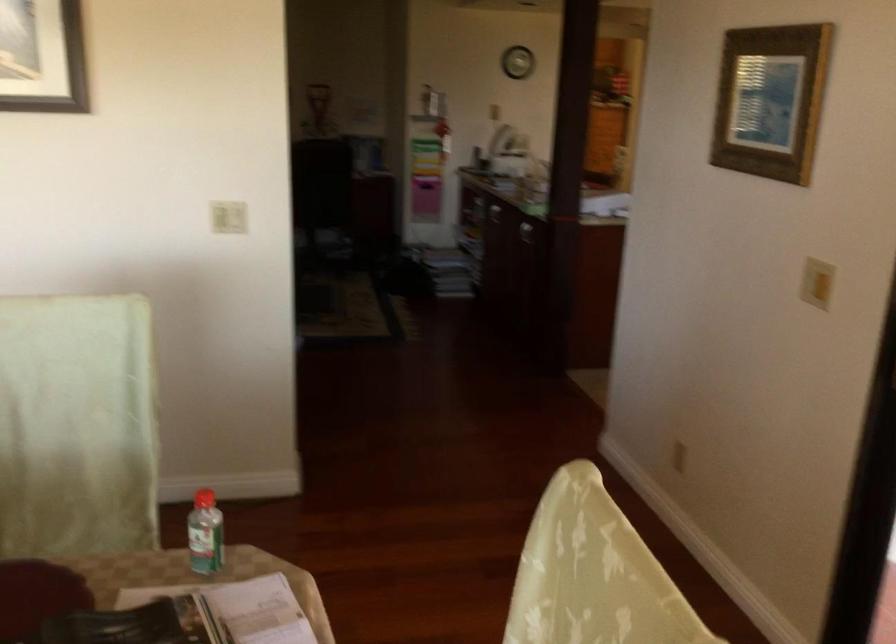
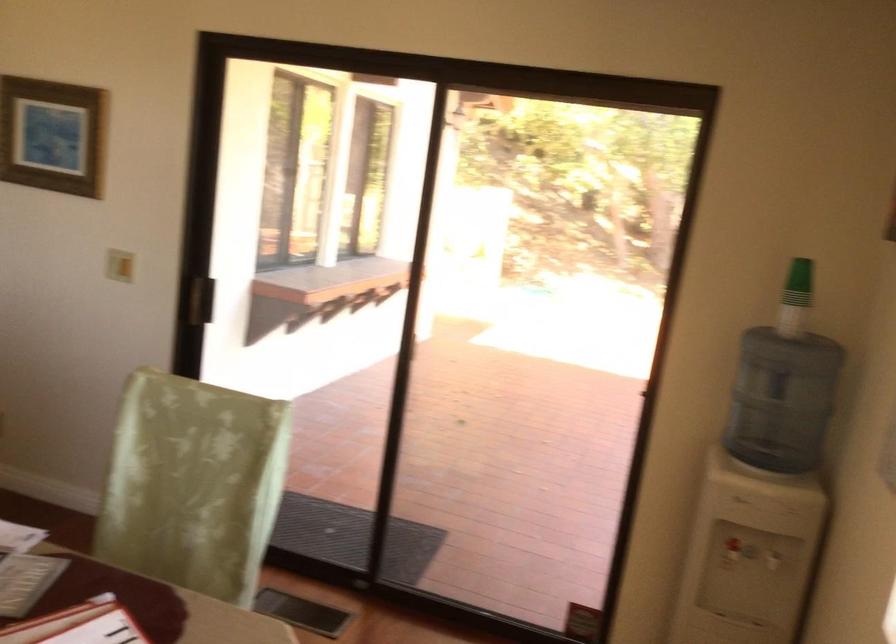
Where in the second image is the point corresponding to (825,307) from the first image?

(119, 265)